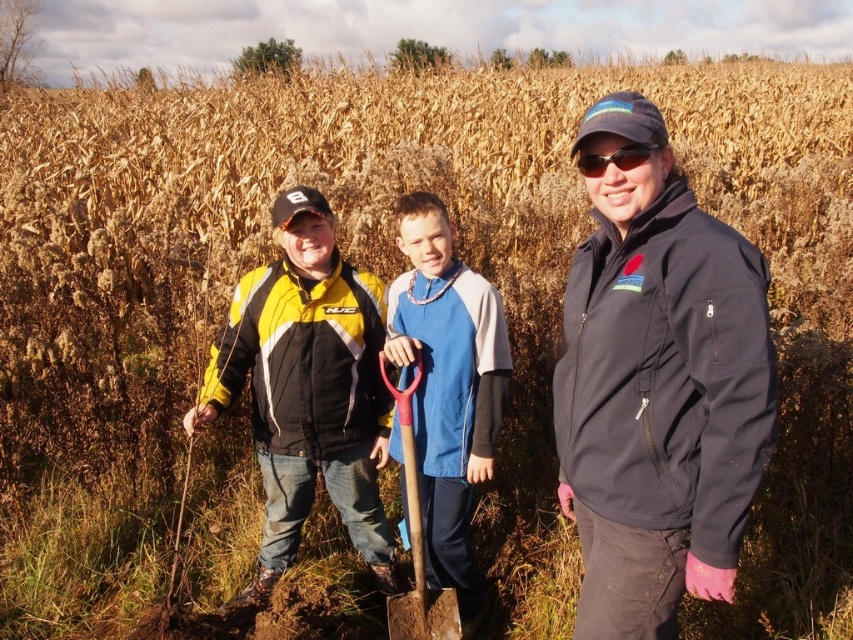
Question: Which object is the farthest from the black plastic sunglasses at center?

Choices:
 (A) dark blue softshell jacket at center
 (B) blue fleece jacket at center

Answer: (B)

Question: Where is blue fleece jacket at center located in relation to red plastic shovel at center in the image?

Choices:
 (A) right
 (B) left

Answer: (A)

Question: Among these points, which one is farthest from the camera?

Choices:
 (A) (664, 269)
 (B) (399, 451)
 (C) (367, 548)
 (D) (421, 572)

Answer: (C)

Question: Is yellow/black jacket at center thinner than black plastic sunglasses at center?

Choices:
 (A) no
 (B) yes

Answer: (A)

Question: Which object appears farthest from the camera in this image?

Choices:
 (A) blue fleece jacket at center
 (B) dark blue softshell jacket at center
 (C) yellow/black jacket at center
 (D) red plastic shovel at center

Answer: (C)

Question: Does blue fleece jacket at center appear over red plastic shovel at center?

Choices:
 (A) yes
 (B) no

Answer: (A)